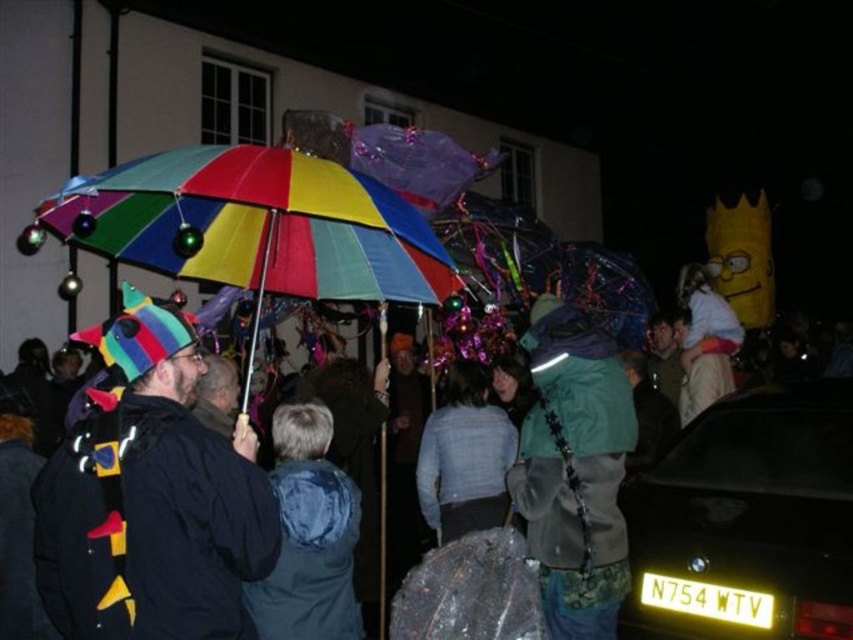
Question: Does yellow plastic license plate at lower right appear over white fluffy costume at upper right?

Choices:
 (A) no
 (B) yes

Answer: (A)

Question: Can you confirm if matte black jacket at center is wider than blue quilted jacket at center?

Choices:
 (A) yes
 (B) no

Answer: (A)

Question: Which of the following is the closest to the observer?

Choices:
 (A) (784, 428)
 (B) (543, 419)
 (C) (722, 632)
 (D) (314, 520)

Answer: (D)

Question: Which object is the farthest from the white fluffy costume at upper right?

Choices:
 (A) rainbow fabric umbrella at center
 (B) yellow plastic license plate at lower right
 (C) green matte jacket at center
 (D) blue quilted jacket at center

Answer: (A)

Question: Is matte black jacket at center wider than white fluffy costume at upper right?

Choices:
 (A) yes
 (B) no

Answer: (A)

Question: Among these objects, which one is farthest from the camera?

Choices:
 (A) matte black jacket at center
 (B) light blue fabric jacket at center
 (C) green matte jacket at center
 (D) white fluffy costume at upper right

Answer: (D)